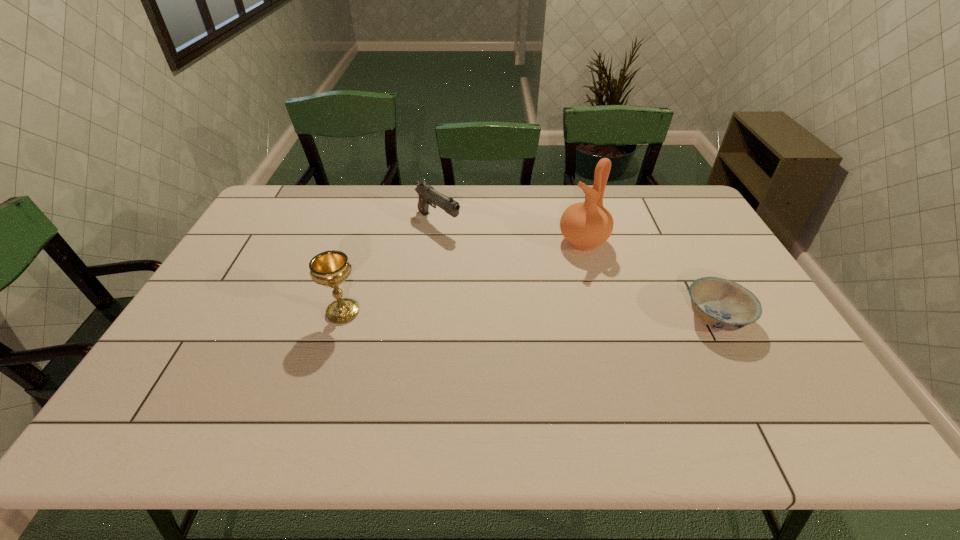
Where is `free spot between the chalice and the tallest object`? This screenshot has width=960, height=540. free spot between the chalice and the tallest object is located at coordinates (463, 276).

Where is `vacant space that's between the chalice and the tallest object`? vacant space that's between the chalice and the tallest object is located at coordinates (463, 276).

Identify the location of vacant space in between the gun and the shortest object. (577, 269).

Identify the location of vacant area between the rightmost object and the second object from left to right. Image resolution: width=960 pixels, height=540 pixels. (577, 269).

Identify the location of free area in between the second object from left to right and the shortest object. The width and height of the screenshot is (960, 540). (577, 269).

Choose which object is the nearest neighbor to the pottery. Please provide its 2D coordinates. Your answer should be formatted as a tuple, i.e. [(x, y)], where the tuple contains the x and y coordinates of a point satisfying the conditions above.

[(722, 304)]

Image resolution: width=960 pixels, height=540 pixels. I want to click on object that stands as the closest to the pottery, so click(x=722, y=304).

In order to click on free space that satisfies the following two spatial constraints: 1. on the front side of the shortest object; 2. on the right side of the third shortest object in this screenshot , I will do `click(342, 317)`.

Locate an element on the screen. free space that satisfies the following two spatial constraints: 1. on the back side of the chalice; 2. on the left side of the third object from left to right is located at coordinates (365, 241).